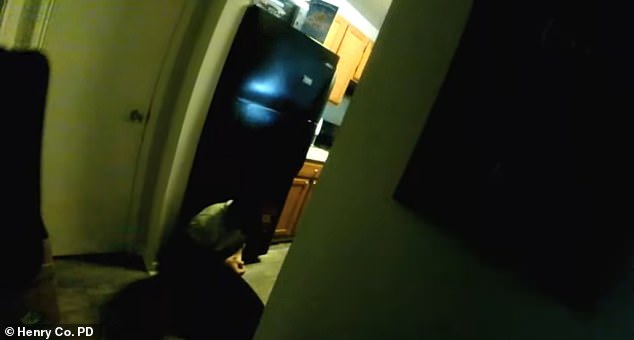
Image resolution: width=634 pixels, height=340 pixels. What are the coordinates of `fridge door` in the screenshot? It's located at (285, 156).